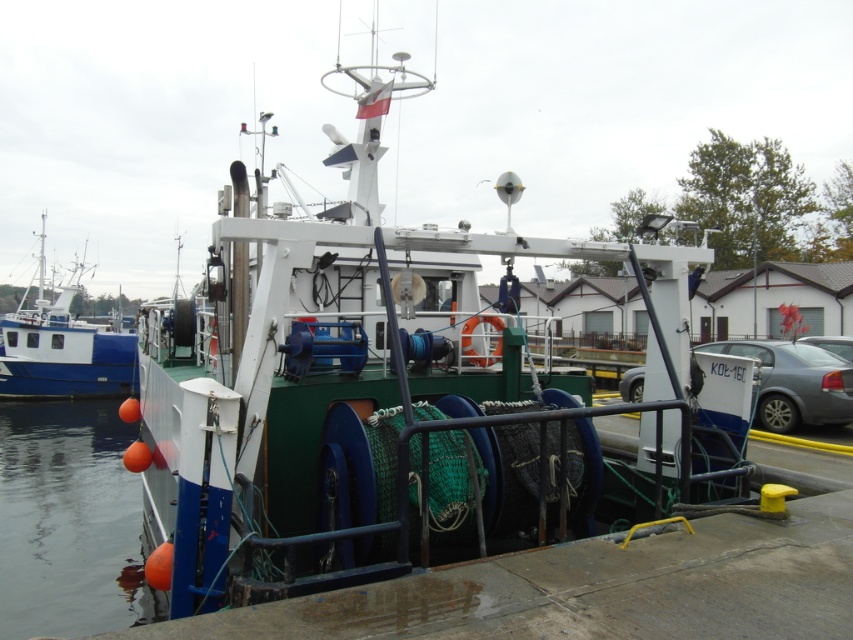
Which is behind, point (33, 305) or point (828, 400)?

The point (33, 305) is more distant.

Describe the element at coordinates (62, 348) in the screenshot. I see `blue matte boat at left` at that location.

The width and height of the screenshot is (853, 640). In order to click on blue matte boat at left in this screenshot , I will do `click(62, 348)`.

Consider the image. Between orange rubber buoy at lower left and silver metallic car at right, which one has less height?

orange rubber buoy at lower left

Is point (91, 429) behind point (751, 353)?

Yes, point (91, 429) is farther from viewer.

Is point (27, 476) farther from camera compared to point (779, 355)?

Yes, it is.

Where is `orange rubber buoy at lower left`? Image resolution: width=853 pixels, height=640 pixels. orange rubber buoy at lower left is located at coordinates (67, 520).

Between green matte boat at center and silver metallic car at right, which one appears on the left side from the viewer's perspective?

From the viewer's perspective, green matte boat at center appears more on the left side.

Does green matte boat at center have a smaller size compared to silver metallic car at right?

Actually, green matte boat at center might be larger than silver metallic car at right.

Identify the location of green matte boat at center. Image resolution: width=853 pixels, height=640 pixels. (384, 397).

This screenshot has width=853, height=640. What are the coordinates of `green matte boat at center` in the screenshot? It's located at (384, 397).